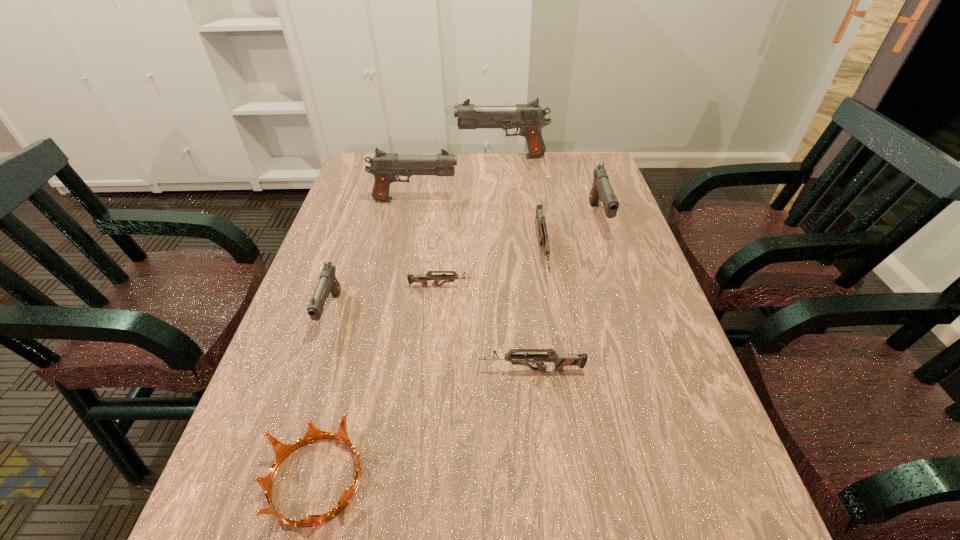
Image resolution: width=960 pixels, height=540 pixels. I want to click on free space between the fifth shortest gun and the fourth tallest gun, so click(465, 265).

What are the coordinates of `vacant space in between the fifth tallest gun and the second tallest gun` in the screenshot? It's located at (479, 226).

Identify the location of free area in between the fourth shortest gun and the biggest gray gun. The width and height of the screenshot is (960, 540). (416, 234).

Locate an element on the screen. free space between the gold crown and the tallest gun is located at coordinates (409, 318).

You are a GUI agent. You are given a task and a screenshot of the screen. Output one action in this format:
    pyautogui.click(x=<x>, y=<y>)
    Task: Click on the free space between the nearest gray gun and the shortest gun
    
    Given the screenshot: What is the action you would take?
    click(x=386, y=299)

Where is `object that is the third nearest to the leftmost grey gun`? The height and width of the screenshot is (540, 960). object that is the third nearest to the leftmost grey gun is located at coordinates (560, 360).

In order to click on object that is the third nearest to the nearest grey gun in this screenshot , I will do (542, 229).

Where is `gun that is the third closest to the third tallest object`? gun that is the third closest to the third tallest object is located at coordinates pos(423,279).

Identify the location of gun identified as the fifth closest to the second tallest object. This screenshot has height=540, width=960. (601, 189).

Locate which gray gun ranks in proximity to the leftmost grey gun. Please provide its 2D coordinates. Your answer should be formatted as a tuple, i.e. [(x, y)], where the tuple contains the x and y coordinates of a point satisfying the conditions above.

[(328, 282)]